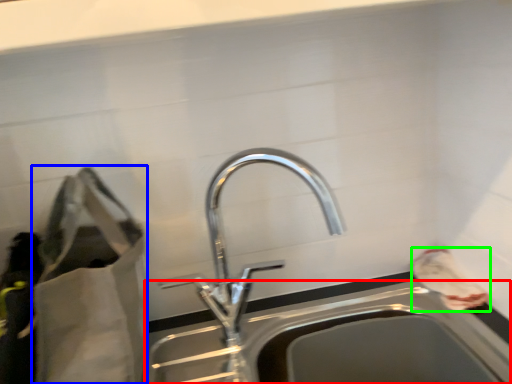
Question: Which object is positioned farthest from sink (highlighted by a red box)? Select from bag (highlighted by a blue box) and bag (highlighted by a green box).

Choices:
 (A) bag
 (B) bag

Answer: (A)